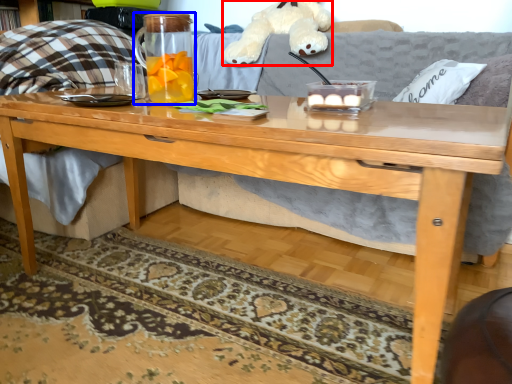
Question: Among these objects, which one is nearest to the camera, toy (highlighted by a red box) or beverage (highlighted by a blue box)?

Choices:
 (A) toy
 (B) beverage

Answer: (B)